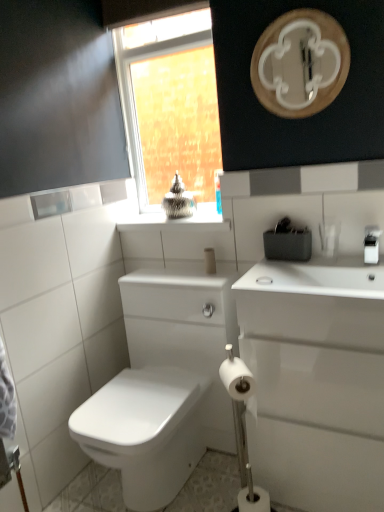
Question: Is white matte cylindrical container at center to the left or to the right of white matte toilet paper at lower center, the 2th toilet paper from the top, in the image?

Choices:
 (A) left
 (B) right

Answer: (A)

Question: Considering their positions, is white matte cylindrical container at center located in front of or behind white matte toilet paper at lower center, the 2th toilet paper from the top?

Choices:
 (A) front
 (B) behind

Answer: (B)

Question: Which object is positioned farthest from the white glossy mirror at upper center?

Choices:
 (A) white matte toilet paper at lower center, which is the first toilet paper in bottom-to-top order
 (B) white matte soap at center
 (C) white matte cylindrical container at center
 (D) clear glass window at upper center
 (E) white glossy counter top at upper center

Answer: (A)

Question: Which is farther from the white matte cylindrical container at center?

Choices:
 (A) white glossy sink at right
 (B) white matte soap at center
 (C) white matte toilet paper at lower center, the 2th toilet paper from the top
 (D) clear glass window at upper center
 (E) white matte toilet paper at lower center, which is counted as the 1th toilet paper, starting from the top

Answer: (D)